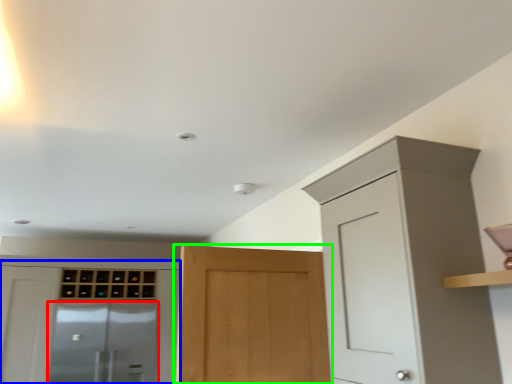
Question: Which is farther away from screen door (highlighted by a red box)? cabinetry (highlighted by a blue box) or door (highlighted by a green box)?

Choices:
 (A) cabinetry
 (B) door

Answer: (B)